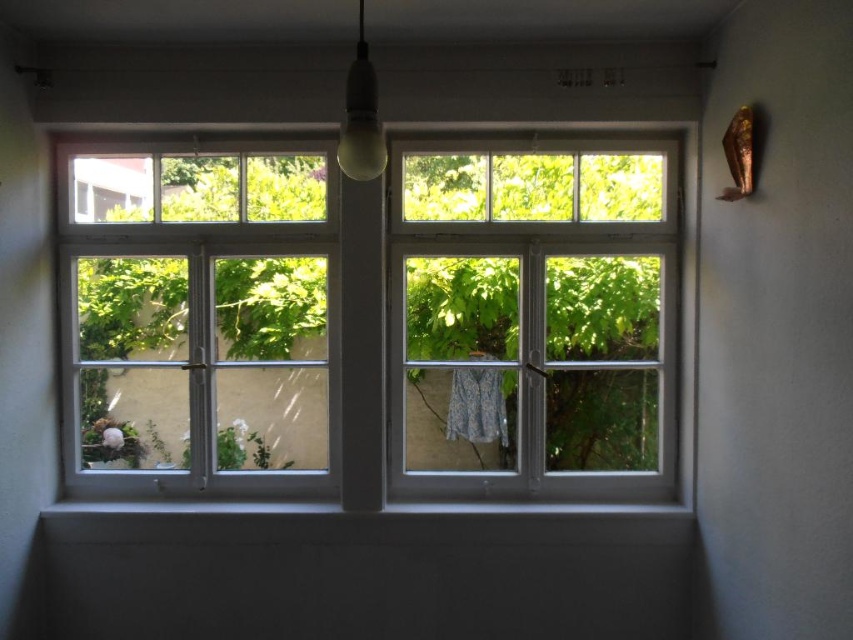
You are standing in the room and want to look outside through the clear glass window at center. Where should you position yourself to see the entire window view?

You should position yourself at point [532,317] to see the entire window view through the clear glass window at center.

You are standing in the room looking at the window. There are two points marked on the window frame, one at coordinates point (416, 465) and the other at point (120, 307). Which point is closer to you?

Point (120, 307) is closer to you because it is less further away than point (416, 465).